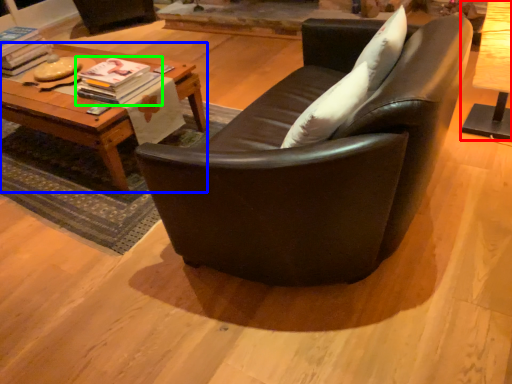
Question: Which object is positioned farthest from table (highlighted by a red box)? Select from table (highlighted by a blue box) and magazine (highlighted by a green box).

Choices:
 (A) table
 (B) magazine

Answer: (A)